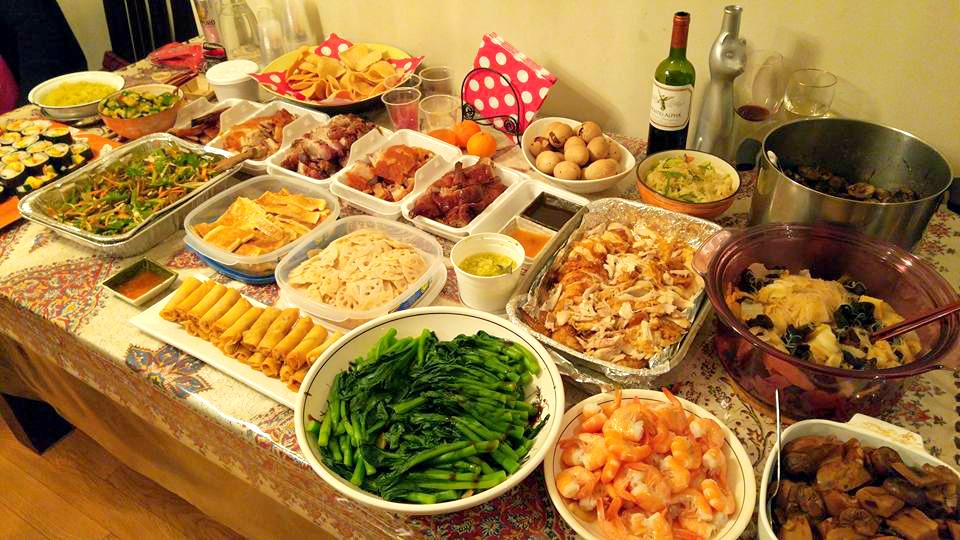
Where is `pot`? The image size is (960, 540). pot is located at coordinates click(868, 202).